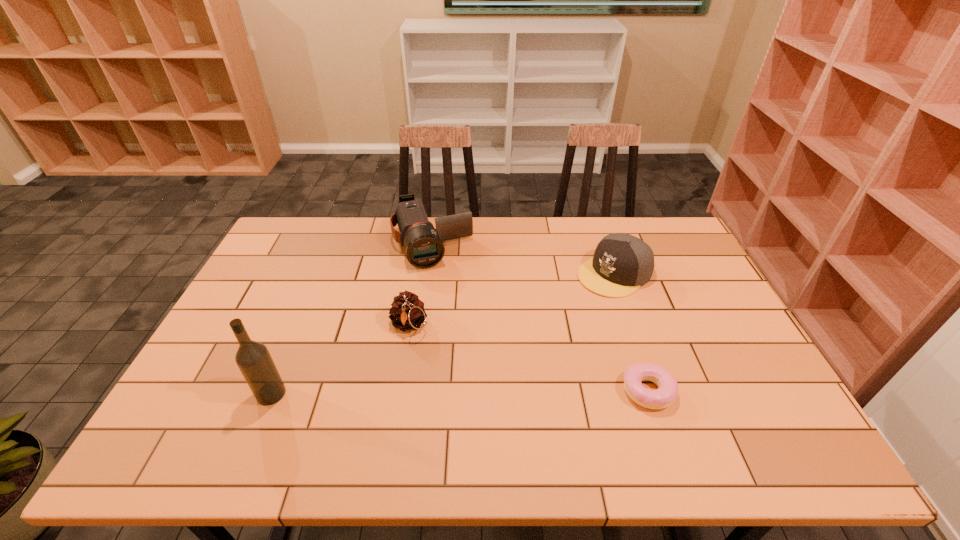
At what (x,y) coordinates should I click in order to perform the action: click on vacant space on the desktop that is between the vodka and the doughnut and is positioned on the front-facing side of the cap. Please return your answer as a coordinate pair (x, y). Image resolution: width=960 pixels, height=540 pixels. Looking at the image, I should click on (426, 393).

This screenshot has width=960, height=540. I want to click on vacant space on the desktop that is between the tallest object and the shortest object and is positioned on the lens of the camcorder, so click(x=486, y=392).

Identify the location of vacant spot on the desktop that is between the leftmost object and the doughnut and is positioned with a leaf charm attached to the third nearest object. (408, 393).